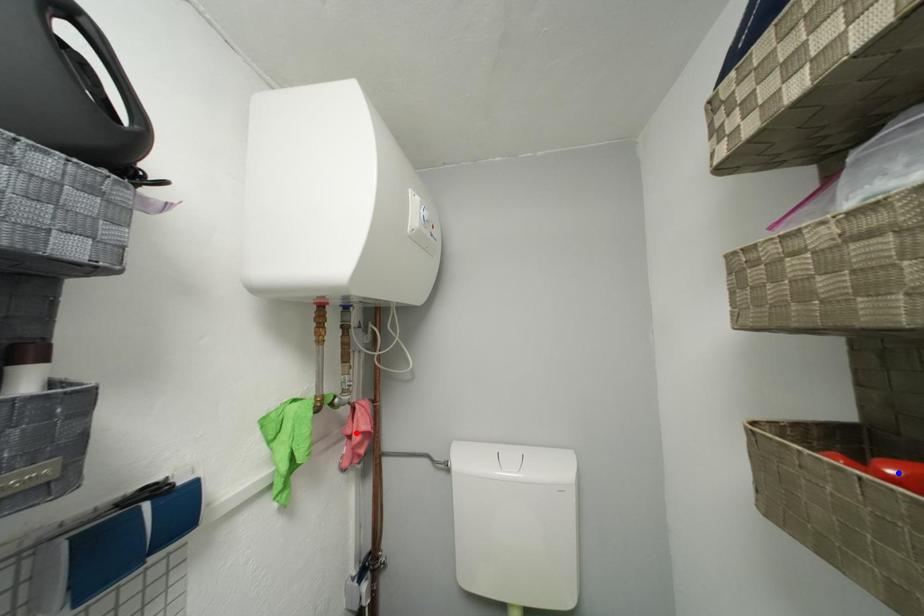
Question: Two points are marked on the image. Which point is closer to the camera?

Choices:
 (A) Blue point is closer.
 (B) Red point is closer.

Answer: (A)